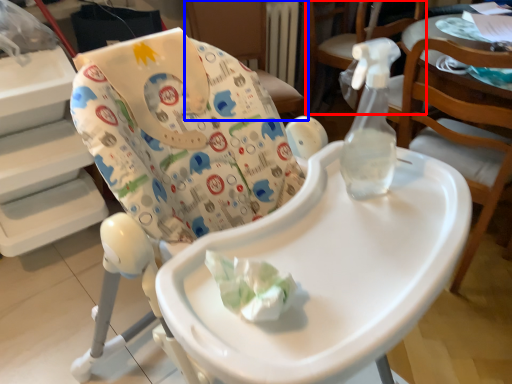
Question: Among these objects, which one is farthest to the camera, chair (highlighted by a red box) or chair (highlighted by a blue box)?

Choices:
 (A) chair
 (B) chair

Answer: (B)